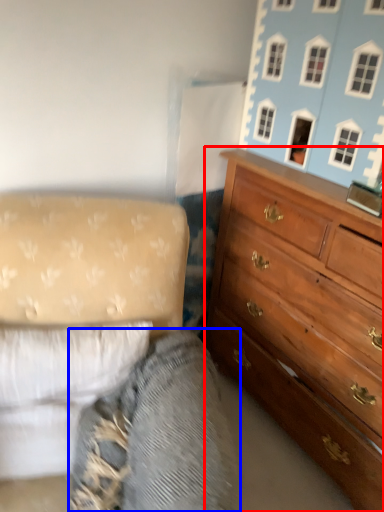
Question: Which object is closer to the camera taking this photo, chest of drawers (highlighted by a red box) or gray (highlighted by a blue box)?

Choices:
 (A) chest of drawers
 (B) gray

Answer: (B)